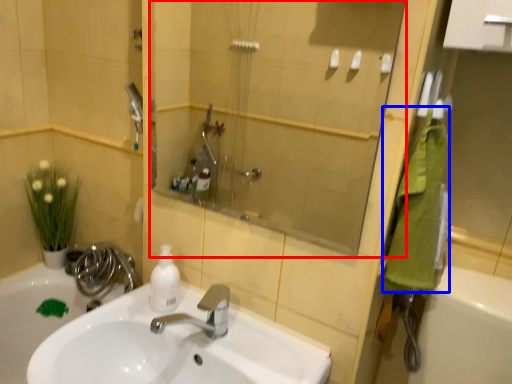
Question: Which of the following is the closest to the observer, mirror (highlighted by a red box) or bath towel (highlighted by a blue box)?

Choices:
 (A) mirror
 (B) bath towel

Answer: (A)